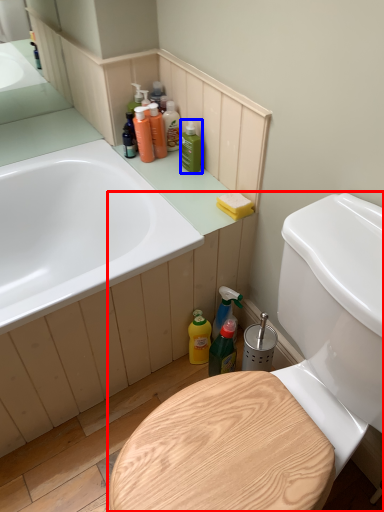
Question: Which object is further to the camera taking this photo, toilet (highlighted by a red box) or cleaning product (highlighted by a blue box)?

Choices:
 (A) toilet
 (B) cleaning product

Answer: (B)